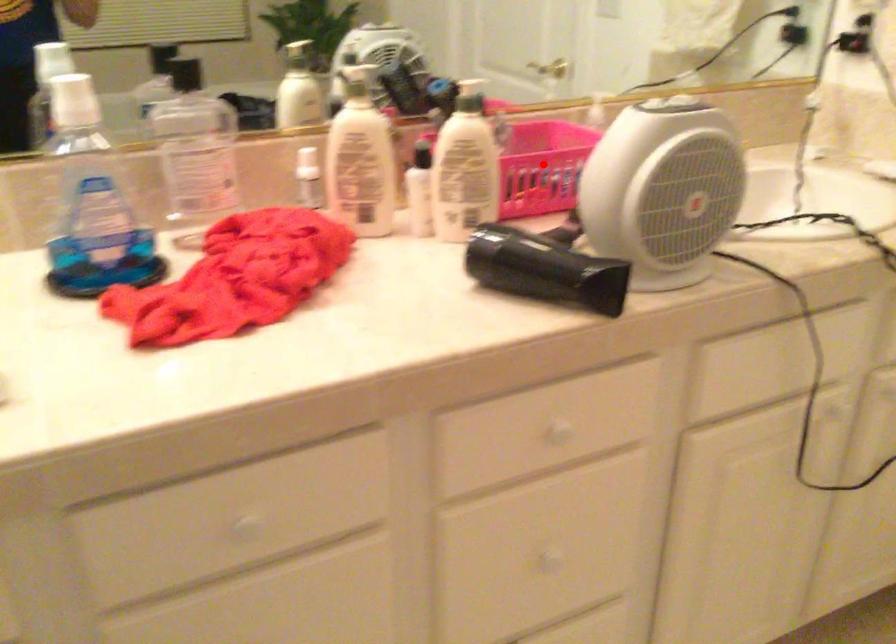
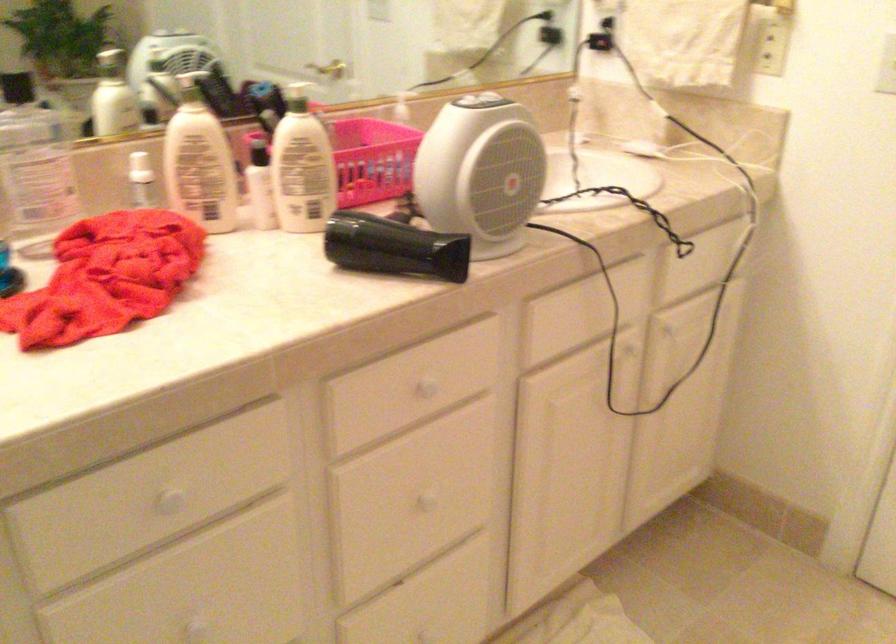
Locate, in the second image, the point that corresponds to the highlighted location in the first image.

(367, 158)